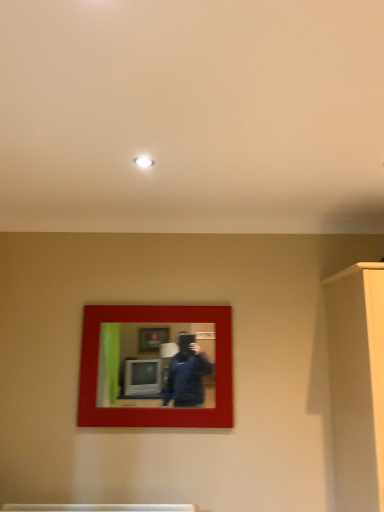
Measure the distance between matte red mirror at center and camera.

A distance of 2.43 meters exists between matte red mirror at center and camera.

The width and height of the screenshot is (384, 512). What are the coordinates of `matte red mirror at center` in the screenshot? It's located at (x=152, y=366).

Describe the element at coordinates (152, 366) in the screenshot. I see `matte red mirror at center` at that location.

I want to click on matte red mirror at center, so click(x=152, y=366).